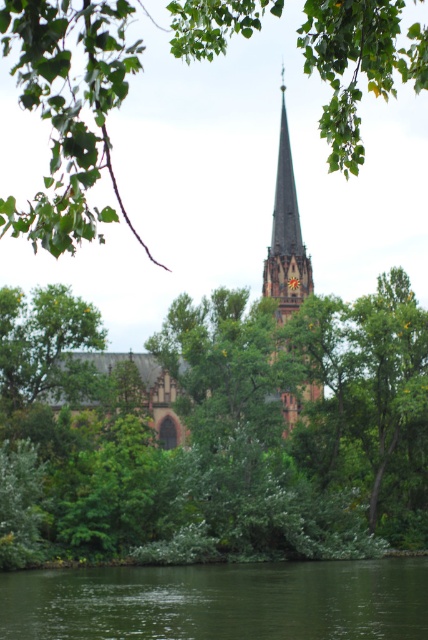
Question: Can you confirm if green leafy tree at center is positioned to the right of green smooth water at lower center?

Choices:
 (A) yes
 (B) no

Answer: (B)

Question: Which point is farther to the camera?

Choices:
 (A) (309, 385)
 (B) (14, 609)
 (C) (58, 225)

Answer: (A)

Question: In this image, where is green smooth water at lower center located relative to brown stone church at center?

Choices:
 (A) below
 (B) above

Answer: (A)

Question: Which point is closer to the camera?

Choices:
 (A) (71, 160)
 (B) (287, 177)
 (C) (166, 428)
 (D) (24, 316)

Answer: (A)

Question: Which of the following is the closest to the observer?

Choices:
 (A) (329, 129)
 (B) (285, 144)

Answer: (A)

Question: Where is green leafy tree at center located in relation to brown stone church at center in the image?

Choices:
 (A) below
 (B) above

Answer: (A)